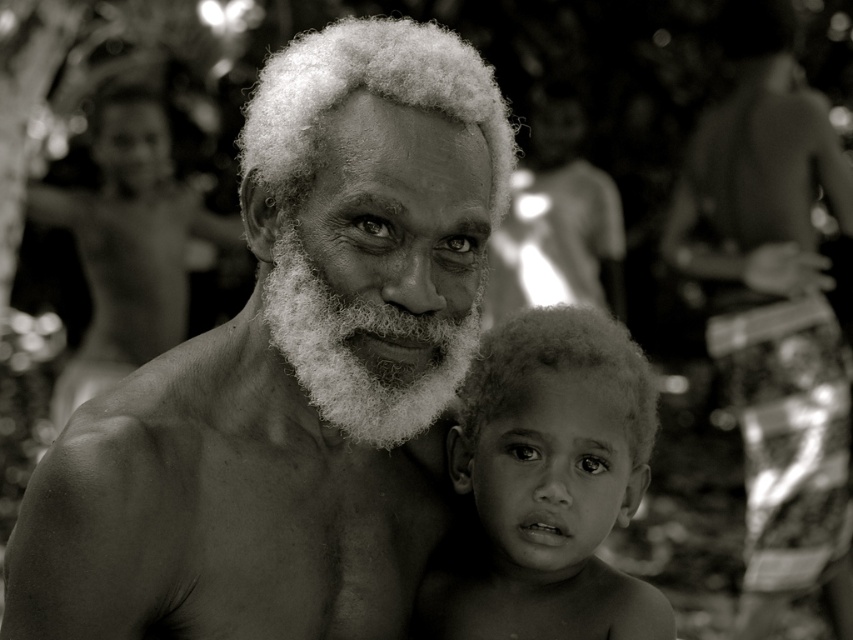
You are standing 1.5 meters away from the image. Can you reach the point at coordinates point (183, 566) if your arm can extend 0.5 meters?

The distance of point (183, 566) from viewer is 1.19 meters. Since you are standing 1.5 meters away from the image, the total distance to the point is 1.5 meters plus 1.19 meters, totaling 2.69 meters. Your arm can only extend 0.5 meters, so you cannot reach the point at coordinates point (183, 566).

Based on the scene description, which object is taller between the curly hair at center and the white fluffy beard at center?

The curly hair at center is taller than the white fluffy beard at center according to the description.